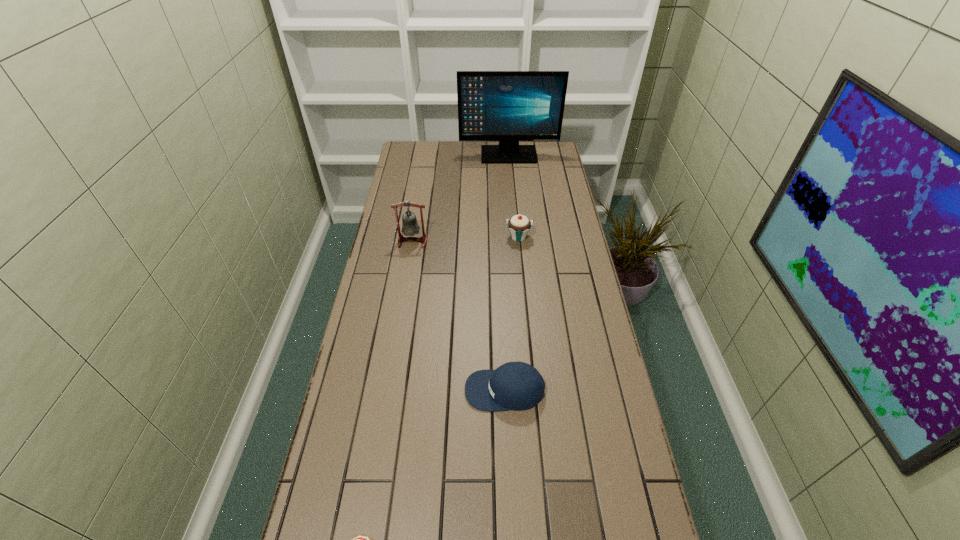
The width and height of the screenshot is (960, 540). I want to click on the farthest object, so click(x=507, y=106).

Where is `the tallest object`? the tallest object is located at coordinates 507,106.

Find the location of a particular element. This screenshot has height=540, width=960. the second tallest object is located at coordinates (410, 227).

The image size is (960, 540). In order to click on the farther cupcake in this screenshot , I will do `click(519, 225)`.

I want to click on the fourth farthest object, so click(x=514, y=385).

This screenshot has height=540, width=960. Identify the location of vacant area situated 0.370m on the screen side of the farthest object. (514, 211).

Find the location of `vacant point located on the right of the bell`. vacant point located on the right of the bell is located at coordinates pos(511,241).

At what (x,y) coordinates should I click in order to perform the action: click on free space located 0.240m on the front of the right cupcake. Please return your answer as a coordinate pair (x, y). Looking at the image, I should click on (524, 292).

Locate an element on the screen. vacant point located on the front-facing side of the baseball cap is located at coordinates (396, 390).

This screenshot has width=960, height=540. Identify the location of free location located 0.050m on the front-facing side of the baseball cap. (446, 390).